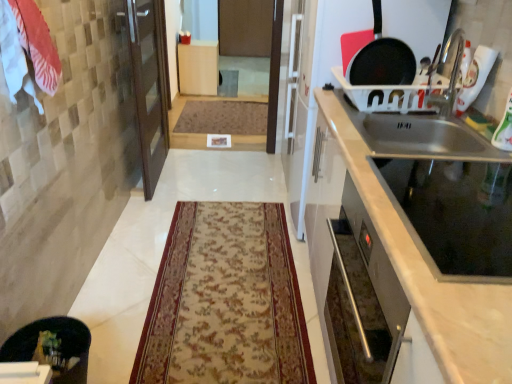
Find the location of a particular element. The width and height of the screenshot is (512, 384). vacant space situated above beige floral rug at center, arranged as the 1th mat when ordered from the bottom (from a real-world perspective) is located at coordinates (229, 267).